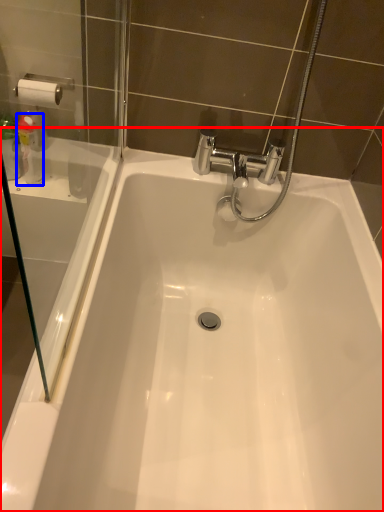
Question: Which object is closer to the camera taking this photo, bathtub (highlighted by a red box) or cleaning product (highlighted by a blue box)?

Choices:
 (A) bathtub
 (B) cleaning product

Answer: (A)